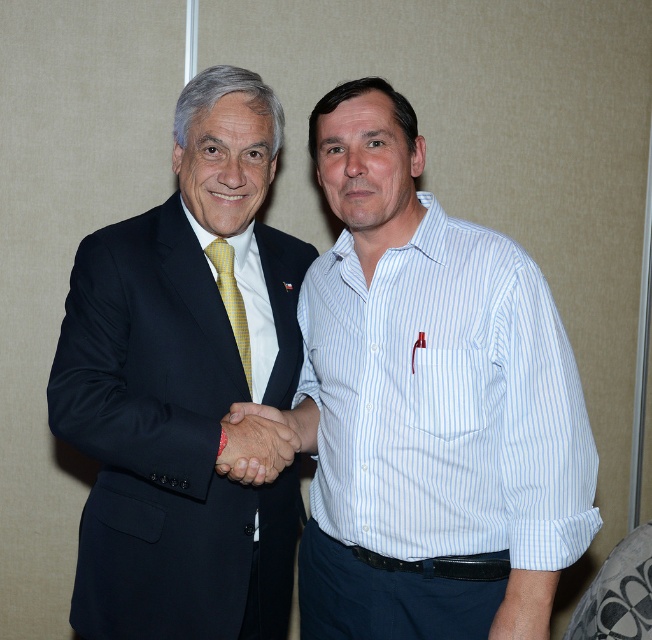
You are a photographer trying to capture the perfect shot of the smooth skin handshake at center. You need to position your camera at point 0.5, 0.5 to frame the scene. Will the handshake be in the center of your photo?

The smooth skin handshake at center is at point (256, 444), which is slightly to the right and down from the center point (326, 320). Therefore, the handshake will not be perfectly centered in the photo.

You are a photographer at a networking event and want to capture the smooth skin handshake at center and the yellowtexturetie at center in a single photo. Which object should you focus on first to ensure both are in frame?

The smooth skin handshake at center is positioned on the right side of yellowtexturetie at center, so focusing on the yellowtexturetie at center first will allow the photographer to include both objects in the frame since the handshake is to the right of the tie.

You are a photographer setting up for a group photo. You want to ensure that the white striped shirt at center and the yellowtexturetie at center are clearly visible in the frame. Given that your camera has a minimum focus distance of 12 inches, will you be able to capture both items in focus without moving the camera closer?

The white striped shirt at center and yellowtexturetie at center are 13.51 inches apart from each other. Since the minimum focus distance is 12 inches, the camera can focus on both items as the distance between them is greater than the minimum required distance.